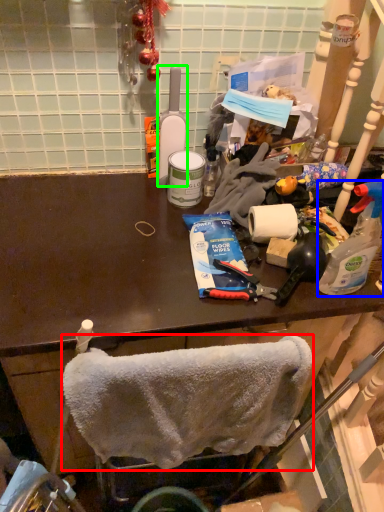
Question: Which is farther away from towel/napkin (highlighted by a red box)? bottle (highlighted by a blue box) or bottle (highlighted by a green box)?

Choices:
 (A) bottle
 (B) bottle

Answer: (B)